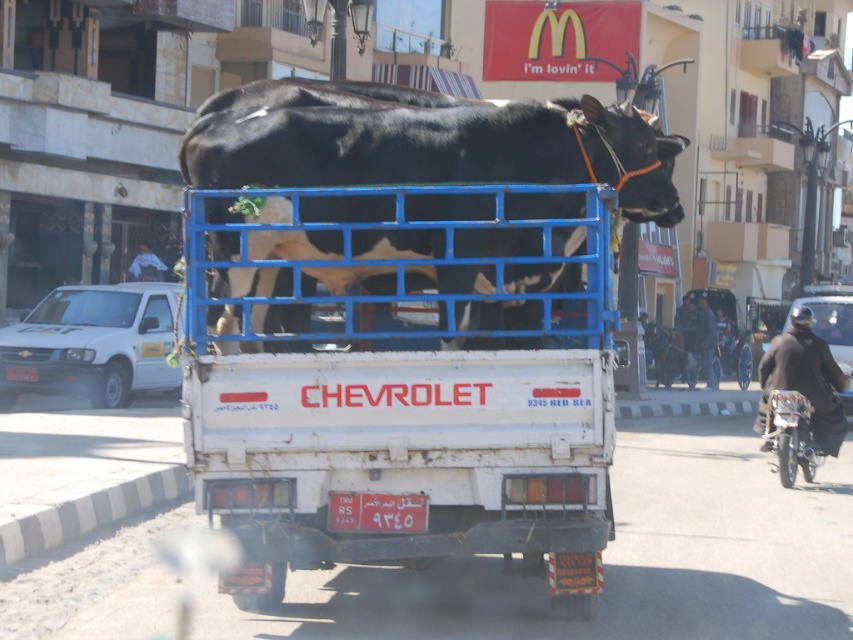
What do you see at coordinates (398, 456) in the screenshot? The height and width of the screenshot is (640, 853). I see `white matte truck at center` at bounding box center [398, 456].

Locate an element on the screen. white matte truck at center is located at coordinates (398, 456).

Between black leather jacket at lower right and metallic silver motorcycle at right, which one has more height?

With more height is metallic silver motorcycle at right.

Is black leather jacket at lower right positioned before metallic silver motorcycle at right?

No.

Between point (769, 362) and point (801, 435), which one is positioned behind?

Point (769, 362)

Where is `black leather jacket at lower right`? Image resolution: width=853 pixels, height=640 pixels. black leather jacket at lower right is located at coordinates (805, 380).

Is shiny black bull at center positioned before black leather jacket at lower right?

Yes, shiny black bull at center is in front of black leather jacket at lower right.

In the scene shown: Which is above, shiny black bull at center or black leather jacket at lower right?

shiny black bull at center

This screenshot has width=853, height=640. Describe the element at coordinates (431, 147) in the screenshot. I see `shiny black bull at center` at that location.

You are a GUI agent. You are given a task and a screenshot of the screen. Output one action in this format:
    pyautogui.click(x=<x>, y=<y>)
    Task: Click on the shiny black bull at center
    
    Given the screenshot: What is the action you would take?
    pyautogui.click(x=431, y=147)